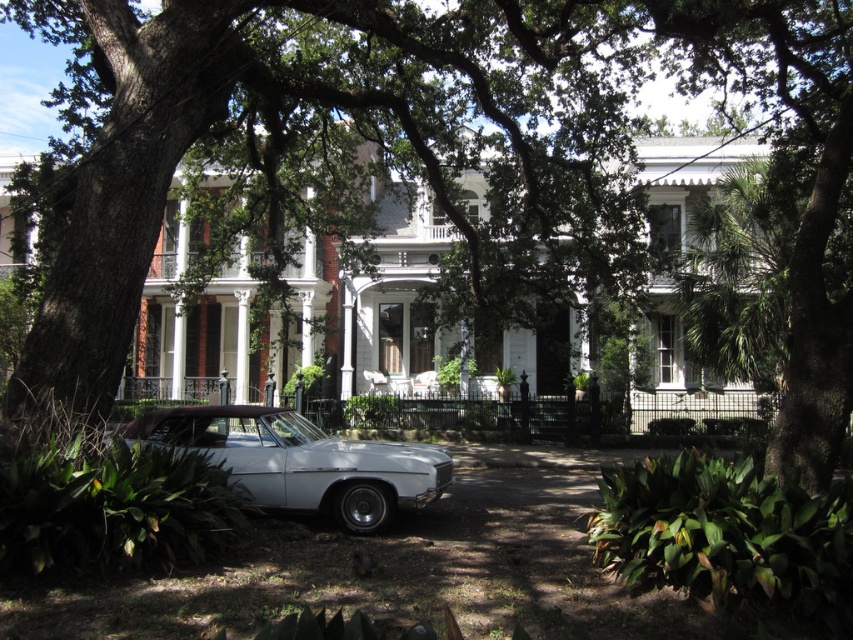
Question: Is green leafy tree at center above white painted wood porch at center?

Choices:
 (A) yes
 (B) no

Answer: (A)

Question: Which is nearer to the white painted wood porch at center?

Choices:
 (A) white glossy car at lower center
 (B) green leafy tree at center

Answer: (B)

Question: Which point is farther to the camera?

Choices:
 (A) (732, 429)
 (B) (183, 148)

Answer: (A)

Question: Can you confirm if green leafy tree at center is positioned above white painted wood porch at center?

Choices:
 (A) yes
 (B) no

Answer: (A)

Question: Estimate the real-world distances between objects in this image. Which object is closer to the white glossy car at lower center?

Choices:
 (A) white painted wood porch at center
 (B) green leafy tree at center

Answer: (B)

Question: Is white glossy car at lower center above white painted wood porch at center?

Choices:
 (A) yes
 (B) no

Answer: (A)